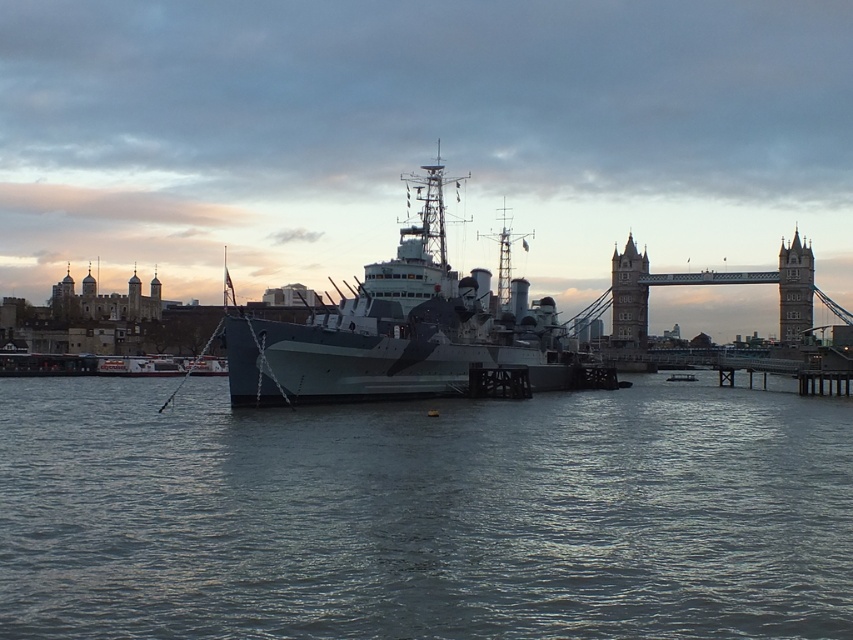
You are a photographer planning to capture the entire view of the camouflage paint ship at center and the gray water at center in one frame. Based on the scene, which one of the two objects would require you to adjust your camera angle to include its full width in the photo?

The gray water at center has a greater width than the camouflage paint ship at center, so you would need to adjust your camera angle to include the full width of the gray water at center.

You are a drone operator tasked with flying a drone between the two stone towers. The drone has a maximum flight distance of 30 meters. Based on the scene, will the drone be able to fly from the stone tower at center to the stone tower at upper right without needing to recharge?

The stone tower at center is 30.14 meters away from the stone tower at upper right. Since the drone has a maximum flight distance of 30 meters, it cannot make the trip without recharging.

Based on the coordinates provided, can you identify which object in the scene corresponds to the point labeled as point (424, 513)?

The point (424, 513) corresponds to the gray water at center.